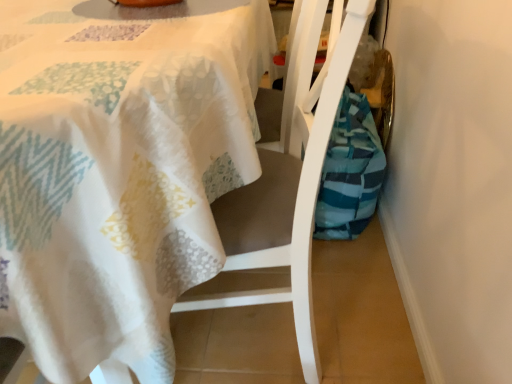
Question: Is white textured tablecloth at upper left looking in the opposite direction of white fabric chair at center?

Choices:
 (A) no
 (B) yes

Answer: (B)

Question: From a real-world perspective, is white textured tablecloth at upper left located higher than white fabric chair at center?

Choices:
 (A) yes
 (B) no

Answer: (B)

Question: Does white textured tablecloth at upper left come behind white fabric chair at center?

Choices:
 (A) yes
 (B) no

Answer: (B)

Question: Is white textured tablecloth at upper left completely or partially outside of white fabric chair at center?

Choices:
 (A) yes
 (B) no

Answer: (A)

Question: Does white textured tablecloth at upper left have a greater width compared to white fabric chair at center?

Choices:
 (A) yes
 (B) no

Answer: (A)

Question: Relative to white textured tablecloth at upper left, is white fabric chair at center in front or behind?

Choices:
 (A) behind
 (B) front

Answer: (A)

Question: Is white fabric chair at center to the left or to the right of white textured tablecloth at upper left in the image?

Choices:
 (A) left
 (B) right

Answer: (B)

Question: Do you think white fabric chair at center is within white textured tablecloth at upper left, or outside of it?

Choices:
 (A) inside
 (B) outside

Answer: (A)

Question: Considering the positions of white fabric chair at center and white textured tablecloth at upper left in the image, is white fabric chair at center wider or thinner than white textured tablecloth at upper left?

Choices:
 (A) wide
 (B) thin

Answer: (B)

Question: From the image's perspective, is white textured tablecloth at upper left above or below teal striped fabric bag at lower right?

Choices:
 (A) above
 (B) below

Answer: (A)

Question: Looking at their shapes, would you say white textured tablecloth at upper left is wider or thinner than teal striped fabric bag at lower right?

Choices:
 (A) wide
 (B) thin

Answer: (A)

Question: Is white textured tablecloth at upper left inside or outside of teal striped fabric bag at lower right?

Choices:
 (A) outside
 (B) inside

Answer: (A)

Question: Would you say white textured tablecloth at upper left is to the left or to the right of teal striped fabric bag at lower right in the picture?

Choices:
 (A) left
 (B) right

Answer: (A)

Question: Visually, is teal striped fabric bag at lower right positioned to the left or to the right of white textured tablecloth at upper left?

Choices:
 (A) left
 (B) right

Answer: (B)

Question: Is teal striped fabric bag at lower right in front of or behind white textured tablecloth at upper left in the image?

Choices:
 (A) behind
 (B) front

Answer: (A)